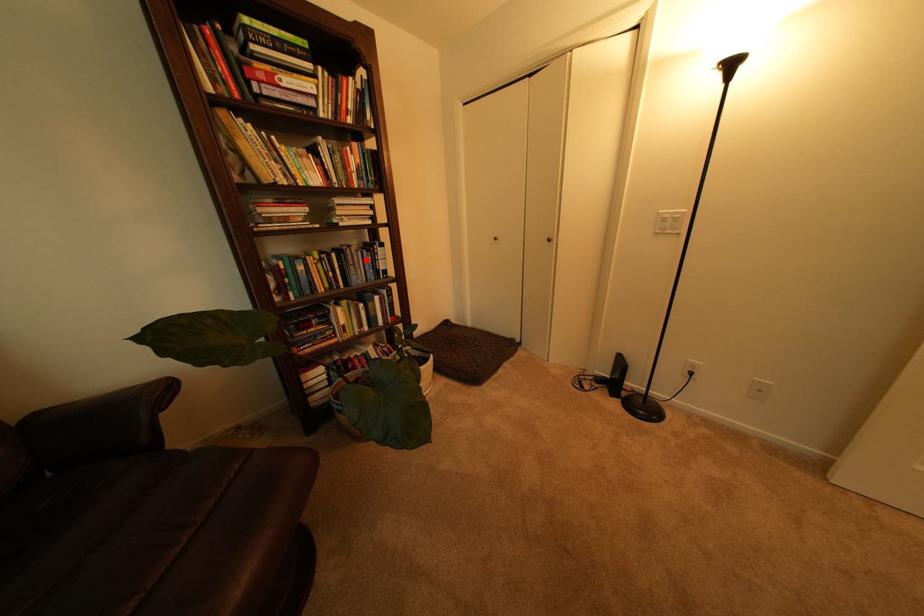
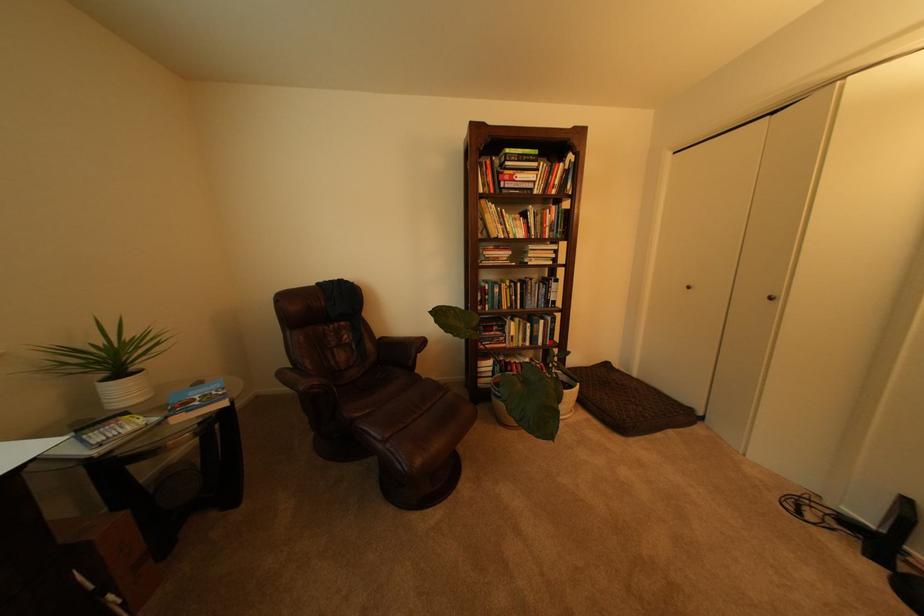
The point at the highlighted location is marked in the first image. Where is the corresponding point in the second image?

(543, 290)